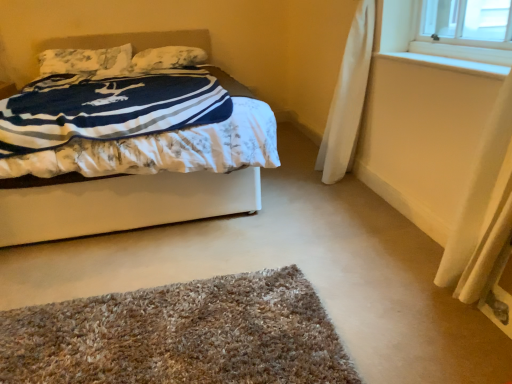
Locate an element on the screen. The image size is (512, 384). white wood at upper right is located at coordinates (458, 61).

Find the location of a particular element. The width and height of the screenshot is (512, 384). white fabric bed at center is located at coordinates (134, 184).

Where is `white soft pillow at upper center, the second pillow positioned from the left`? The width and height of the screenshot is (512, 384). white soft pillow at upper center, the second pillow positioned from the left is located at coordinates (168, 58).

Based on the photo, measure the distance between white soft pillow at upper center, which ranks as the 1th pillow in right-to-left order, and camera.

white soft pillow at upper center, which ranks as the 1th pillow in right-to-left order, is 3.34 meters away from camera.

Image resolution: width=512 pixels, height=384 pixels. I want to click on brown shaggy rug at lower center, so click(180, 335).

Is point (477, 62) positioned in front of point (136, 68)?

Yes, it is in front of point (136, 68).

Looking at this image, from a real-world perspective, is white wood at upper right on white soft pillow at upper center, which ranks as the 1th pillow in right-to-left order?

Yes, from a real-world perspective, white wood at upper right is above white soft pillow at upper center, which ranks as the 1th pillow in right-to-left order.

Is white wood at upper right aimed at white soft pillow at upper center, the second pillow positioned from the left?

No, white wood at upper right is not oriented towards white soft pillow at upper center, the second pillow positioned from the left.

Consider the image. Between white wood at upper right and white soft pillow at upper center, the second pillow positioned from the left, which one appears on the right side from the viewer's perspective?

Positioned to the right is white wood at upper right.

From a real-world perspective, who is located lower, brown shaggy rug at lower center or white fabric bed at center?

brown shaggy rug at lower center.

Is brown shaggy rug at lower center not near white fabric bed at center?

That's not correct — brown shaggy rug at lower center is a little close to white fabric bed at center.

Is brown shaggy rug at lower center inside the boundaries of white fabric bed at center, or outside?

brown shaggy rug at lower center cannot be found inside white fabric bed at center.

Considering the sizes of white fabric bed at center and white soft pillow at upper center, which ranks as the 1th pillow in right-to-left order, in the image, is white fabric bed at center taller or shorter than white soft pillow at upper center, which ranks as the 1th pillow in right-to-left order,?

white fabric bed at center is taller than white soft pillow at upper center, which ranks as the 1th pillow in right-to-left order.

Considering their positions, is white fabric bed at center located in front of or behind white soft pillow at upper center, the second pillow positioned from the left?

In the image, white fabric bed at center appears in front of white soft pillow at upper center, the second pillow positioned from the left.

In the scene shown: From the image's perspective, is white fabric bed at center on white soft pillow at upper center, the second pillow positioned from the left?

No, from the image's perspective, white fabric bed at center is not on top of white soft pillow at upper center, the second pillow positioned from the left.

Is white fabric bed at center not near white soft pillow at upper center, which ranks as the 1th pillow in right-to-left order?

Yes, white fabric bed at center and white soft pillow at upper center, which ranks as the 1th pillow in right-to-left order, are quite far apart.

Considering the sizes of white wood at upper right and brown shaggy rug at lower center in the image, is white wood at upper right taller or shorter than brown shaggy rug at lower center?

Clearly, white wood at upper right is shorter compared to brown shaggy rug at lower center.

Which is in front, white wood at upper right or brown shaggy rug at lower center?

Positioned in front is brown shaggy rug at lower center.

From the picture: Is white wood at upper right inside the boundaries of brown shaggy rug at lower center, or outside?

white wood at upper right exists outside the volume of brown shaggy rug at lower center.

The image size is (512, 384). What are the coordinates of `bed on the left of white soft pillow at upper center, the second pillow positioned from the left` in the screenshot? It's located at [134, 184].

Is white soft pillow at upper center, the second pillow positioned from the left, far from white fabric bed at center?

Yes.

Could white fabric bed at center be considered to be inside white soft pillow at upper center, which ranks as the 1th pillow in right-to-left order?

No, white fabric bed at center is located outside of white soft pillow at upper center, which ranks as the 1th pillow in right-to-left order.

From the image's perspective, is white soft pillow at upper center, the second pillow positioned from the left, on white fabric bed at center?

Yes, from the image's perspective, white soft pillow at upper center, the second pillow positioned from the left, is above white fabric bed at center.

Does brown shaggy rug at lower center have a lesser height compared to white wood at upper right?

Incorrect, the height of brown shaggy rug at lower center does not fall short of that of white wood at upper right.

Are brown shaggy rug at lower center and white wood at upper right beside each other?

No, brown shaggy rug at lower center is not in contact with white wood at upper right.

Can you tell me how much brown shaggy rug at lower center and white wood at upper right differ in facing direction?

89.5 degrees.

From the image's perspective, is brown shaggy rug at lower center located above white wood at upper right?

Incorrect, from the image's perspective, brown shaggy rug at lower center is lower than white wood at upper right.

Considering the positions of objects white soft pillow at upper center, the second pillow positioned from the left, and brown shaggy rug at lower center in the image provided, who is more to the right, white soft pillow at upper center, the second pillow positioned from the left, or brown shaggy rug at lower center?

brown shaggy rug at lower center is more to the right.

Is white soft pillow at upper center, which ranks as the 1th pillow in right-to-left order, oriented away from brown shaggy rug at lower center?

No, white soft pillow at upper center, which ranks as the 1th pillow in right-to-left order, is not facing away from brown shaggy rug at lower center.

Is point (186, 65) behind point (333, 366)?

That is True.

Is white soft pillow at upper center, which ranks as the 1th pillow in right-to-left order, far away from brown shaggy rug at lower center?

Yes, white soft pillow at upper center, which ranks as the 1th pillow in right-to-left order, and brown shaggy rug at lower center are quite far apart.

Where is `the 1st pillow to the left of the white wood at upper right, counting from the anchor's position`? Image resolution: width=512 pixels, height=384 pixels. the 1st pillow to the left of the white wood at upper right, counting from the anchor's position is located at coordinates (168, 58).

At what (x,y) coordinates should I click in order to perform the action: click on mat below the white fabric bed at center (from the image's perspective). Please return your answer as a coordinate pair (x, y). This screenshot has width=512, height=384. Looking at the image, I should click on (180, 335).

Considering their positions, is fluffy white pillow at upper left, acting as the 2th pillow starting from the right, positioned closer to brown shaggy rug at lower center than white wood at upper right?

Among the two, white wood at upper right is located nearer to brown shaggy rug at lower center.

Considering their positions, is brown shaggy rug at lower center positioned further to white soft pillow at upper center, the second pillow positioned from the left, than white fabric bed at center?

Among the two, brown shaggy rug at lower center is located further to white soft pillow at upper center, the second pillow positioned from the left.

When comparing their distances from white wood at upper right, does brown shaggy rug at lower center or white fabric bed at center seem closer?

Among the two, white fabric bed at center is located nearer to white wood at upper right.

When comparing their distances from fluffy white pillow at upper left, positioned as the 1th pillow in left-to-right order, does white fabric bed at center or white wood at upper right seem further?

The object further to fluffy white pillow at upper left, positioned as the 1th pillow in left-to-right order, is white wood at upper right.

Based on their spatial positions, is brown shaggy rug at lower center or white soft pillow at upper center, which ranks as the 1th pillow in right-to-left order, further from fluffy white pillow at upper left, acting as the 2th pillow starting from the right?

Based on the image, brown shaggy rug at lower center appears to be further to fluffy white pillow at upper left, acting as the 2th pillow starting from the right.

Considering their positions, is white fabric bed at center positioned further to white wood at upper right than white soft pillow at upper center, which ranks as the 1th pillow in right-to-left order?

Among the two, white soft pillow at upper center, which ranks as the 1th pillow in right-to-left order, is located further to white wood at upper right.

Considering their positions, is brown shaggy rug at lower center positioned further to white fabric bed at center than fluffy white pillow at upper left, acting as the 2th pillow starting from the right?

Among the two, fluffy white pillow at upper left, acting as the 2th pillow starting from the right, is located further to white fabric bed at center.

Which object lies nearer to the anchor point brown shaggy rug at lower center, white soft pillow at upper center, which ranks as the 1th pillow in right-to-left order, or white fabric bed at center?

white fabric bed at center is positioned closer to the anchor brown shaggy rug at lower center.

In order to click on pillow located between white fabric bed at center and white soft pillow at upper center, which ranks as the 1th pillow in right-to-left order, in the depth direction in this screenshot , I will do `click(87, 61)`.

You are a GUI agent. You are given a task and a screenshot of the screen. Output one action in this format:
    pyautogui.click(x=<x>, y=<y>)
    Task: Click on the pillow located between brown shaggy rug at lower center and white soft pillow at upper center, the second pillow positioned from the left, in the depth direction
    The width and height of the screenshot is (512, 384).
    Given the screenshot: What is the action you would take?
    pyautogui.click(x=87, y=61)

Find the location of a particular element. Image resolution: width=512 pixels, height=384 pixels. bed between fluffy white pillow at upper left, positioned as the 1th pillow in left-to-right order, and white wood at upper right is located at coordinates (134, 184).

This screenshot has height=384, width=512. Find the location of `mat situated between fluffy white pillow at upper left, acting as the 2th pillow starting from the right, and white wood at upper right from left to right`. mat situated between fluffy white pillow at upper left, acting as the 2th pillow starting from the right, and white wood at upper right from left to right is located at coordinates (180, 335).